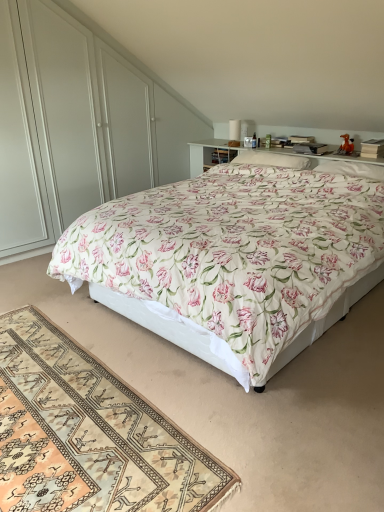
Question: From the image's perspective, is white glossy dresser at upper center located above beige woven rug at lower left?

Choices:
 (A) yes
 (B) no

Answer: (A)

Question: Is white glossy dresser at upper center further to the viewer compared to beige woven rug at lower left?

Choices:
 (A) no
 (B) yes

Answer: (B)

Question: Is white glossy dresser at upper center at the left side of beige woven rug at lower left?

Choices:
 (A) no
 (B) yes

Answer: (A)

Question: From the image's perspective, would you say white glossy dresser at upper center is shown under beige woven rug at lower left?

Choices:
 (A) no
 (B) yes

Answer: (A)

Question: Is white glossy dresser at upper center outside beige woven rug at lower left?

Choices:
 (A) no
 (B) yes

Answer: (B)

Question: Looking at the image, does floral cotton bed at center seem bigger or smaller compared to white glossy dresser at upper center?

Choices:
 (A) big
 (B) small

Answer: (A)

Question: In the image, is floral cotton bed at center on the left side or the right side of white glossy dresser at upper center?

Choices:
 (A) right
 (B) left

Answer: (A)

Question: Considering their positions, is floral cotton bed at center located in front of or behind white glossy dresser at upper center?

Choices:
 (A) behind
 (B) front

Answer: (B)

Question: Does point (256, 305) appear closer or farther from the camera than point (145, 94)?

Choices:
 (A) farther
 (B) closer

Answer: (B)

Question: In terms of size, does white glossy dresser at upper center appear bigger or smaller than floral cotton bed at center?

Choices:
 (A) small
 (B) big

Answer: (A)

Question: From their relative heights in the image, would you say white glossy dresser at upper center is taller or shorter than floral cotton bed at center?

Choices:
 (A) short
 (B) tall

Answer: (B)

Question: From a real-world perspective, relative to floral cotton bed at center, is white glossy dresser at upper center vertically above or below?

Choices:
 (A) below
 (B) above

Answer: (B)

Question: Considering the positions of white glossy dresser at upper center and floral cotton bed at center in the image, is white glossy dresser at upper center wider or thinner than floral cotton bed at center?

Choices:
 (A) wide
 (B) thin

Answer: (B)

Question: Looking at the image, does white glossy dresser at upper center seem bigger or smaller compared to white soft pillow at center, the 1th pillow viewed from the left?

Choices:
 (A) big
 (B) small

Answer: (A)

Question: Considering their positions, is white glossy dresser at upper center located in front of or behind white soft pillow at center, the 2th pillow viewed from the right?

Choices:
 (A) behind
 (B) front

Answer: (B)